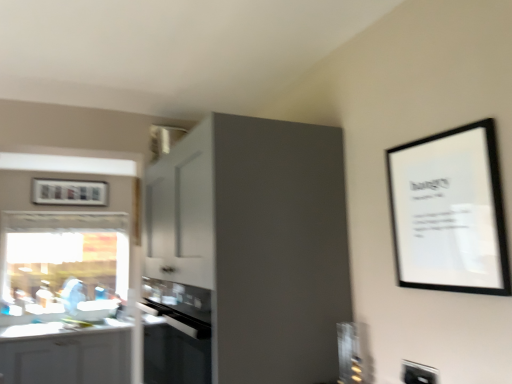
Measure the distance between black glass oven at center and camera.

They are 1.47 meters apart.

Consider the image. What is the approximate width of black glass oven at center?

It is 9.03 inches.

What is the approximate height of white plastic electric outlet at lower right?

The height of white plastic electric outlet at lower right is 9.68 centimeters.

This screenshot has width=512, height=384. Describe the element at coordinates (418, 373) in the screenshot. I see `white plastic electric outlet at lower right` at that location.

The image size is (512, 384). What do you see at coordinates (69, 192) in the screenshot? I see `matte plastic picture frame at upper left, the second picture frame positioned from the front` at bounding box center [69, 192].

This screenshot has width=512, height=384. Describe the element at coordinates (63, 265) in the screenshot. I see `transparent glass window at left` at that location.

What is the approximate width of matte gray cabinet at upper center, which appears as the 1th cabinetry when viewed from the front?

63.35 centimeters.

You are a GUI agent. You are given a task and a screenshot of the screen. Output one action in this format:
    pyautogui.click(x=<x>, y=<y>)
    Task: Click on the black matte picture frame at upper right, which is the 1th picture frame from front to back
    Image resolution: width=512 pixels, height=384 pixels.
    Given the screenshot: What is the action you would take?
    pyautogui.click(x=449, y=212)

From the image's perspective, does matte gray cabinet at upper center, which appears as the 1th cabinetry when viewed from the front, appear lower than white glossy countertop at lower left?

No.

In terms of height, does matte gray cabinet at upper center, which appears as the second cabinetry when ordered from the bottom, look taller or shorter compared to white glossy countertop at lower left?

In the image, matte gray cabinet at upper center, which appears as the second cabinetry when ordered from the bottom, appears to be taller than white glossy countertop at lower left.

Is matte gray cabinet at upper center, which is the second cabinetry in left-to-right order, at the left side of white glossy countertop at lower left?

In fact, matte gray cabinet at upper center, which is the second cabinetry in left-to-right order, is to the right of white glossy countertop at lower left.

Is matte gray cabinet at upper center, which is the 1th cabinetry from right to left, turned away from white glossy countertop at lower left?

matte gray cabinet at upper center, which is the 1th cabinetry from right to left, does not have its back to white glossy countertop at lower left.

Is matte gray cabinet at upper center, which appears as the 1th cabinetry when viewed from the front, wider or thinner than white plastic electric outlet at lower right?

Considering their sizes, matte gray cabinet at upper center, which appears as the 1th cabinetry when viewed from the front, looks broader than white plastic electric outlet at lower right.

At what (x,y) coordinates should I click in order to perform the action: click on the 1st cabinetry counting from the left side of the white plastic electric outlet at lower right. Please return your answer as a coordinate pair (x, y). Looking at the image, I should click on (247, 254).

Does matte gray cabinet at upper center, which is the 1th cabinetry from right to left, have a lesser height compared to white plastic electric outlet at lower right?

Incorrect, the height of matte gray cabinet at upper center, which is the 1th cabinetry from right to left, does not fall short of that of white plastic electric outlet at lower right.

From a real-world perspective, does matte gray cabinet at upper center, marked as the 2th cabinetry in a back-to-front arrangement, stand above white plastic electric outlet at lower right?

Yes, from a real-world perspective, matte gray cabinet at upper center, marked as the 2th cabinetry in a back-to-front arrangement, is on top of white plastic electric outlet at lower right.

What's the angular difference between matte gray cabinet at upper center, which appears as the 1th cabinetry when viewed from the front, and white glossy cabinet at lower left, the 1th cabinetry positioned from the left,'s facing directions?

They differ by 89.6 degrees in their facing directions.

From the image's perspective, is matte gray cabinet at upper center, marked as the 2th cabinetry in a back-to-front arrangement, over white glossy cabinet at lower left, positioned as the first cabinetry in back-to-front order?

Indeed, from the image's perspective, matte gray cabinet at upper center, marked as the 2th cabinetry in a back-to-front arrangement, is shown above white glossy cabinet at lower left, positioned as the first cabinetry in back-to-front order.

Between matte gray cabinet at upper center, which is the 1th cabinetry from right to left, and white glossy cabinet at lower left, which is the 2th cabinetry from top to bottom, which one is positioned behind?

Positioned behind is white glossy cabinet at lower left, which is the 2th cabinetry from top to bottom.

Is matte gray cabinet at upper center, which is the 1th cabinetry from right to left, not close to white glossy cabinet at lower left, placed as the second cabinetry when sorted from front to back?

Absolutely, matte gray cabinet at upper center, which is the 1th cabinetry from right to left, is distant from white glossy cabinet at lower left, placed as the second cabinetry when sorted from front to back.

Considering the relative positions of matte gray cabinet at upper center, which is the 1th cabinetry from right to left, and matte plastic picture frame at upper left, positioned as the first picture frame in left-to-right order, in the image provided, is matte gray cabinet at upper center, which is the 1th cabinetry from right to left, to the left or to the right of matte plastic picture frame at upper left, positioned as the first picture frame in left-to-right order,?

Clearly, matte gray cabinet at upper center, which is the 1th cabinetry from right to left, is on the right of matte plastic picture frame at upper left, positioned as the first picture frame in left-to-right order, in the image.

From the image's perspective, which is above, matte gray cabinet at upper center, which is the second cabinetry in left-to-right order, or matte plastic picture frame at upper left, marked as the second picture frame in a right-to-left arrangement?

matte plastic picture frame at upper left, marked as the second picture frame in a right-to-left arrangement, from the image's perspective.

Considering the sizes of objects matte gray cabinet at upper center, which appears as the second cabinetry when ordered from the bottom, and matte plastic picture frame at upper left, marked as the second picture frame in a right-to-left arrangement, in the image provided, who is thinner, matte gray cabinet at upper center, which appears as the second cabinetry when ordered from the bottom, or matte plastic picture frame at upper left, marked as the second picture frame in a right-to-left arrangement,?

matte plastic picture frame at upper left, marked as the second picture frame in a right-to-left arrangement.

How different are the orientations of matte gray cabinet at upper center, which appears as the second cabinetry when ordered from the bottom, and matte plastic picture frame at upper left, marked as the second picture frame in a right-to-left arrangement, in degrees?

They differ by 90 degrees in their facing directions.

Relative to black matte picture frame at upper right, which is the 1th picture frame from front to back, is white glossy countertop at lower left in front or behind?

Clearly, white glossy countertop at lower left is behind black matte picture frame at upper right, which is the 1th picture frame from front to back.

Is white glossy countertop at lower left taller than black matte picture frame at upper right, which appears as the 2th picture frame when viewed from the left?

Incorrect, the height of white glossy countertop at lower left is not larger of that of black matte picture frame at upper right, which appears as the 2th picture frame when viewed from the left.

Where is `picture frame that is on the right side of white glossy countertop at lower left`? This screenshot has height=384, width=512. picture frame that is on the right side of white glossy countertop at lower left is located at coordinates (449, 212).

From a real-world perspective, between white glossy countertop at lower left and black matte picture frame at upper right, which appears as the 2th picture frame when viewed from the left, who is vertically lower?

white glossy countertop at lower left.

Is transparent glass window at left touching black glass oven at center?

There is a gap between transparent glass window at left and black glass oven at center.

Is transparent glass window at left oriented away from black glass oven at center?

No, transparent glass window at left is not facing the opposite direction of black glass oven at center.

From a real-world perspective, is transparent glass window at left positioned over black glass oven at center based on gravity?

Yes, from a real-world perspective, transparent glass window at left is over black glass oven at center

Is matte gray cabinet at upper center, which appears as the 1th cabinetry when viewed from the front, spatially inside transparent glass window at left, or outside of it?

matte gray cabinet at upper center, which appears as the 1th cabinetry when viewed from the front, is spatially situated outside transparent glass window at left.

Which is behind, point (215, 148) or point (77, 216)?

The point (77, 216) is behind.

The width and height of the screenshot is (512, 384). What are the coordinates of `cabinetry that is the 2nd object to the right of the transparent glass window at left, starting at the anchor` in the screenshot? It's located at (247, 254).

Considering the sizes of objects matte gray cabinet at upper center, marked as the 2th cabinetry in a back-to-front arrangement, and transparent glass window at left in the image provided, who is smaller, matte gray cabinet at upper center, marked as the 2th cabinetry in a back-to-front arrangement, or transparent glass window at left?

transparent glass window at left.

The height and width of the screenshot is (384, 512). Identify the location of countertop below the matte gray cabinet at upper center, which is the second cabinetry in left-to-right order (from the image's perspective). (57, 330).

Identify the location of the 1st cabinetry to the left of the white plastic electric outlet at lower right, starting your count from the anchor. The width and height of the screenshot is (512, 384). (247, 254).

From the image, which object appears to be nearer to matte plastic picture frame at upper left, the 1th picture frame positioned from the back, white plastic electric outlet at lower right or black glass oven at center?

black glass oven at center.

From the picture: Which object lies further to the anchor point white plastic electric outlet at lower right, black matte picture frame at upper right, which appears as the 2th picture frame when viewed from the left, or matte plastic picture frame at upper left, positioned as the first picture frame in left-to-right order?

matte plastic picture frame at upper left, positioned as the first picture frame in left-to-right order, is further to white plastic electric outlet at lower right.

Estimate the real-world distances between objects in this image. Which object is closer to white plastic electric outlet at lower right, matte plastic picture frame at upper left, positioned as the first picture frame in left-to-right order, or white glossy countertop at lower left?

white glossy countertop at lower left.

Considering their positions, is black glass oven at center positioned further to white glossy cabinet at lower left, positioned as the 1th cabinetry in bottom-to-top order, than transparent glass window at left?

The object further to white glossy cabinet at lower left, positioned as the 1th cabinetry in bottom-to-top order, is black glass oven at center.

Looking at the image, which one is located further to transparent glass window at left, black glass oven at center or white glossy cabinet at lower left, arranged as the second cabinetry when viewed from the right?

black glass oven at center is further to transparent glass window at left.

Considering their positions, is white glossy cabinet at lower left, the 1th cabinetry positioned from the left, positioned closer to matte gray cabinet at upper center, which appears as the second cabinetry when ordered from the bottom, than black glass oven at center?

black glass oven at center lies closer to matte gray cabinet at upper center, which appears as the second cabinetry when ordered from the bottom, than the other object.

Looking at the image, which one is located closer to white plastic electric outlet at lower right, transparent glass window at left or matte gray cabinet at upper center, which appears as the 1th cabinetry when viewed from the front?

matte gray cabinet at upper center, which appears as the 1th cabinetry when viewed from the front, lies closer to white plastic electric outlet at lower right than the other object.

In the scene shown: Considering their positions, is white plastic electric outlet at lower right positioned closer to black glass oven at center than white glossy cabinet at lower left, arranged as the second cabinetry when viewed from the right?

white plastic electric outlet at lower right is positioned closer to the anchor black glass oven at center.

The height and width of the screenshot is (384, 512). Identify the location of countertop between white plastic electric outlet at lower right and matte plastic picture frame at upper left, the second picture frame positioned from the front, in the front-back direction. (57, 330).

Where is `oven between matte gray cabinet at upper center, marked as the 2th cabinetry in a back-to-front arrangement, and white glossy cabinet at lower left, which is the 2th cabinetry from top to bottom, along the z-axis`? oven between matte gray cabinet at upper center, marked as the 2th cabinetry in a back-to-front arrangement, and white glossy cabinet at lower left, which is the 2th cabinetry from top to bottom, along the z-axis is located at coordinates (174, 355).

Find the location of a particular element. This screenshot has width=512, height=384. electric outlet positioned between black matte picture frame at upper right, arranged as the second picture frame when viewed from the back, and white glossy countertop at lower left from near to far is located at coordinates (418, 373).

Locate an element on the screen. The image size is (512, 384). window between black matte picture frame at upper right, which is the 1th picture frame from front to back, and matte plastic picture frame at upper left, the 1th picture frame positioned from the back, in the front-back direction is located at coordinates (63, 265).